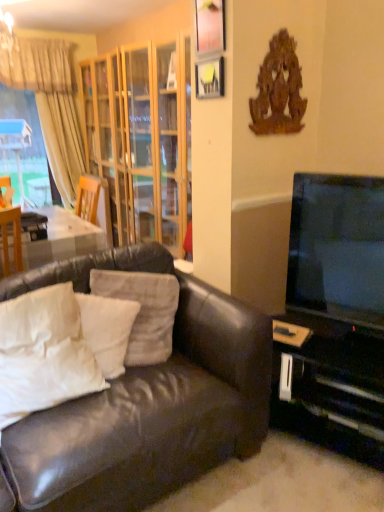
Question: Is the depth of beige fabric curtain at upper left greater than that of wooden picture frame at upper center, which ranks as the first picture frame in top-to-bottom order?

Choices:
 (A) yes
 (B) no

Answer: (A)

Question: From a real-world perspective, is beige fabric curtain at upper left located beneath wooden picture frame at upper center, which ranks as the first picture frame in top-to-bottom order?

Choices:
 (A) no
 (B) yes

Answer: (B)

Question: Is beige fabric curtain at upper left directly adjacent to wooden picture frame at upper center, which ranks as the 2th picture frame in bottom-to-top order?

Choices:
 (A) no
 (B) yes

Answer: (A)

Question: Does beige fabric curtain at upper left have a greater width compared to wooden picture frame at upper center, which ranks as the 2th picture frame in bottom-to-top order?

Choices:
 (A) no
 (B) yes

Answer: (B)

Question: Does beige fabric curtain at upper left have a lesser width compared to wooden picture frame at upper center, which ranks as the 2th picture frame in bottom-to-top order?

Choices:
 (A) no
 (B) yes

Answer: (A)

Question: Considering the relative positions of white soft pillow at center, the second pillow in the right-to-left sequence, and white soft pillow at left, the 3th pillow in the right-to-left sequence, in the image provided, is white soft pillow at center, the second pillow in the right-to-left sequence, to the left or to the right of white soft pillow at left, the 3th pillow in the right-to-left sequence,?

Choices:
 (A) right
 (B) left

Answer: (A)

Question: Considering their positions, is white soft pillow at center, the second pillow in the right-to-left sequence, located in front of or behind white soft pillow at left, the 3th pillow in the right-to-left sequence?

Choices:
 (A) front
 (B) behind

Answer: (B)

Question: From a real-world perspective, is white soft pillow at center, the second pillow in the right-to-left sequence, above or below white soft pillow at left, the 3th pillow in the right-to-left sequence?

Choices:
 (A) above
 (B) below

Answer: (B)

Question: Would you say white soft pillow at center, the 2th pillow in the left-to-right sequence, is inside or outside white soft pillow at left, the 1th pillow from the left?

Choices:
 (A) outside
 (B) inside

Answer: (A)

Question: From a real-world perspective, relative to matte yellow picture frame at upper center, acting as the 1th picture frame starting from the bottom, is leather couch at lower left vertically above or below?

Choices:
 (A) below
 (B) above

Answer: (A)

Question: Is leather couch at lower left to the left or to the right of matte yellow picture frame at upper center, the 2th picture frame positioned from the top, in the image?

Choices:
 (A) right
 (B) left

Answer: (B)

Question: From their relative heights in the image, would you say leather couch at lower left is taller or shorter than matte yellow picture frame at upper center, acting as the 1th picture frame starting from the bottom?

Choices:
 (A) tall
 (B) short

Answer: (A)

Question: Considering the positions of leather couch at lower left and matte yellow picture frame at upper center, acting as the 1th picture frame starting from the bottom, in the image, is leather couch at lower left wider or thinner than matte yellow picture frame at upper center, acting as the 1th picture frame starting from the bottom,?

Choices:
 (A) wide
 (B) thin

Answer: (A)

Question: From a real-world perspective, is white soft pillow at left, the 1th pillow from the left, physically located above or below beige fabric curtain at upper left?

Choices:
 (A) above
 (B) below

Answer: (B)

Question: Is white soft pillow at left, the 1th pillow from the left, wider or thinner than beige fabric curtain at upper left?

Choices:
 (A) wide
 (B) thin

Answer: (A)